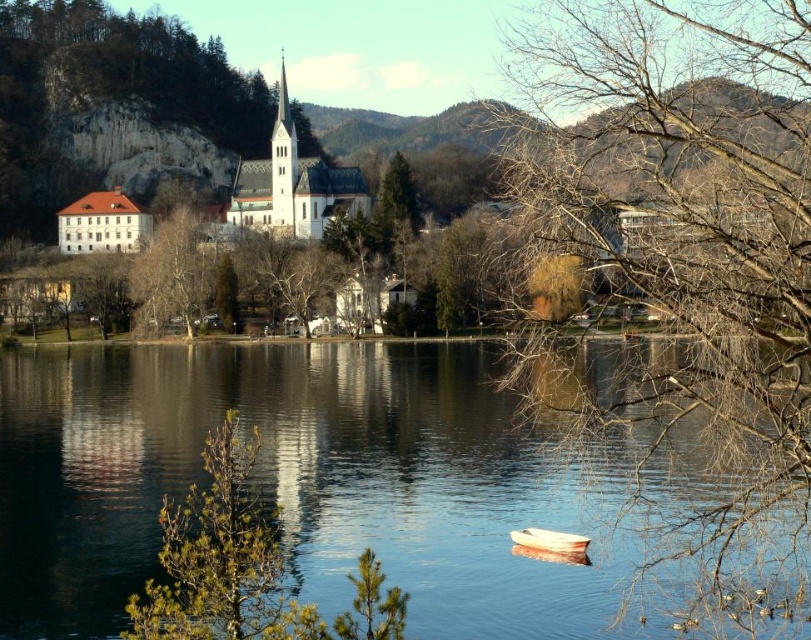
Is point (531, 138) closer to camera compared to point (103, 205)?

Yes, it is.

From the picture: Can you confirm if bare branches at center is thinner than white matte building at center?

No, bare branches at center is not thinner than white matte building at center.

Is point (702, 352) behind point (97, 225)?

No.

The height and width of the screenshot is (640, 811). I want to click on bare branches at center, so [684, 221].

Describe the element at coordinates (221, 557) in the screenshot. I see `green needle-like tree at center` at that location.

Who is positioned more to the left, green needle-like tree at center or green textured tree at center?

green textured tree at center is more to the left.

Does point (187, 544) lie behind point (230, 291)?

No, (187, 544) is closer to viewer.

At what (x,y) coordinates should I click in order to perform the action: click on green needle-like tree at center. Please return your answer as a coordinate pair (x, y). Looking at the image, I should click on (221, 557).

Is white stone church at left below white stone church at center?

Actually, white stone church at left is above white stone church at center.

Who is higher up, white stone church at left or white stone church at center?

Positioned higher is white stone church at left.

Looking at this image, who is more distant from viewer, (217, 172) or (346, 209)?

The point (217, 172) is more distant.

At what (x,y) coordinates should I click in order to perform the action: click on white stone church at left. Please return your answer as a coordinate pair (x, y). The width and height of the screenshot is (811, 640). Looking at the image, I should click on (277, 182).